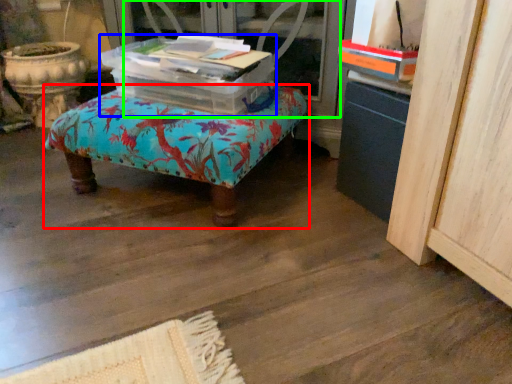
Question: Which object is the farthest from furniture (highlighted by a red box)? Choose among these: storage box (highlighted by a blue box) or screen door (highlighted by a green box).

Choices:
 (A) storage box
 (B) screen door

Answer: (B)